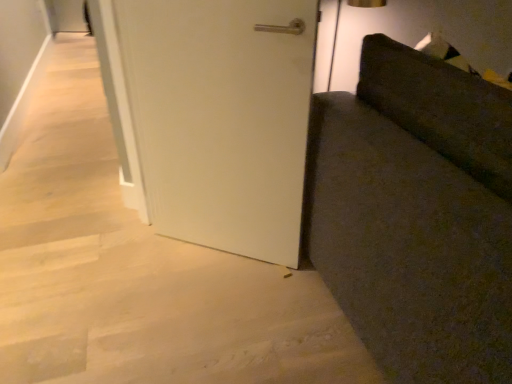
Locate an element on the screen. vacant space underneath white matte door at center (from a real-world perspective) is located at coordinates (217, 252).